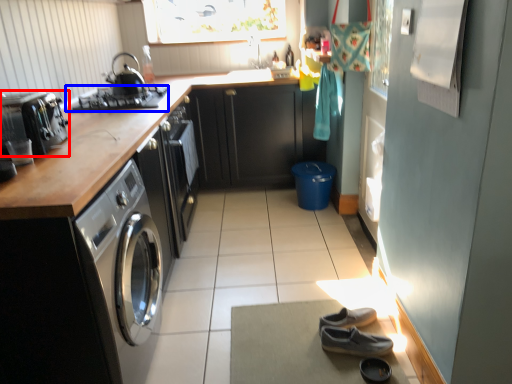
Question: Which of the following is the closest to the observer, home appliance (highlighted by a red box) or gas stove (highlighted by a blue box)?

Choices:
 (A) home appliance
 (B) gas stove

Answer: (A)